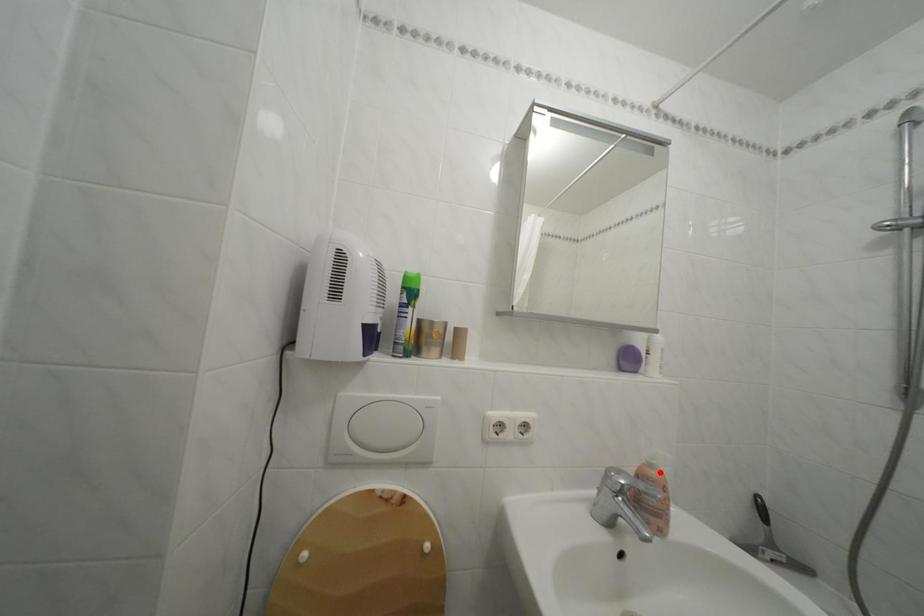
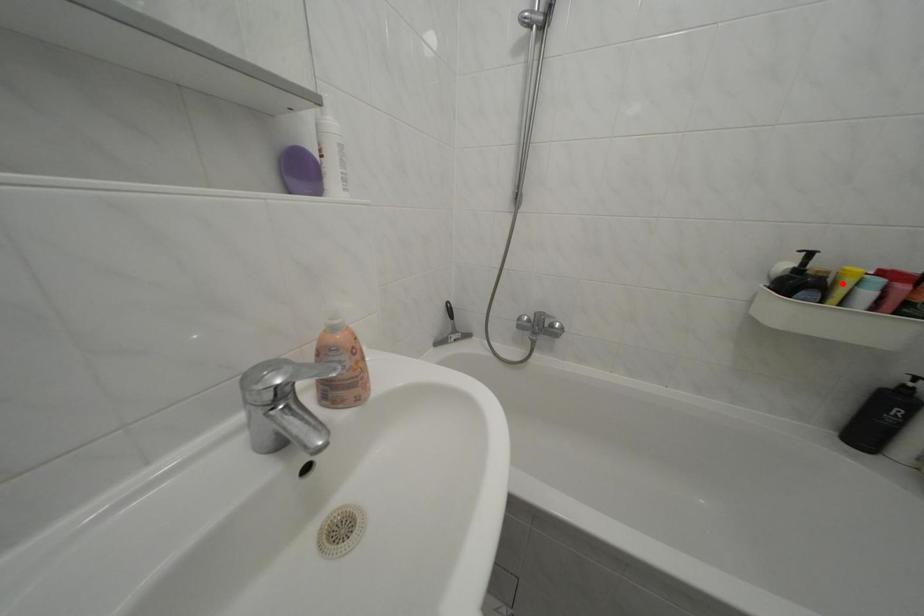
I am providing you with two images of the same scene from different viewpoints. A red point is marked on the first image and another point is marked on the second image. Do the highlighted points in image1 and image2 indicate the same real-world spot?

No